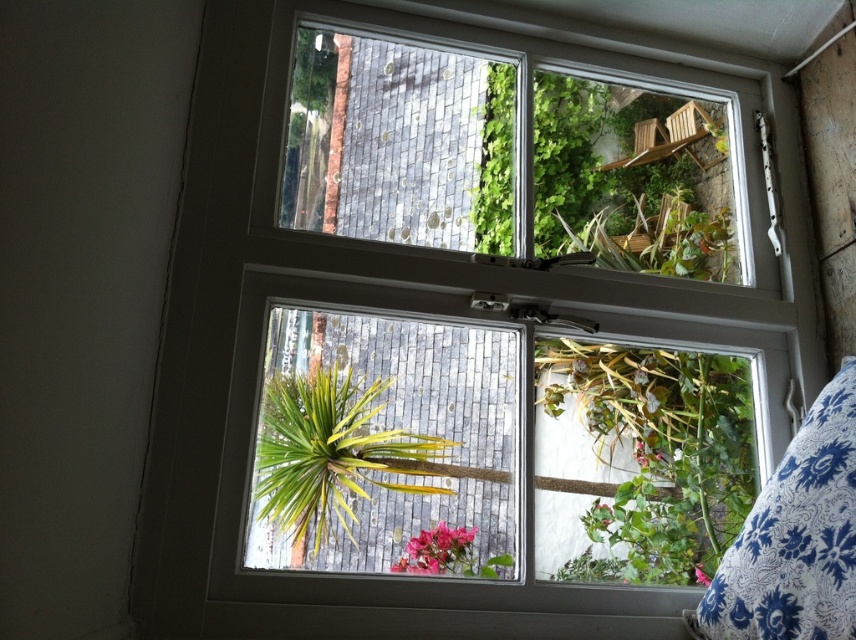
You are a gardener looking at the window with two green leafy plants visible. Which of the two plants, the green leafy plant at lower right or the green leafy plant at center, has a wider spread?

The green leafy plant at lower right has a wider spread than the green leafy plant at center.

You are a gardener who needs to water the plants outside the window. You have a watering can that can reach up to 5 feet. The green leafy plant at lower right is one of the plants you need to water. Can you reach it from where you are standing without moving your position?

The green leafy plant at lower right is 5.18 feet away, which is beyond the 5 feet reach of the watering can. Therefore, you cannot reach it without moving your position.

You are arranging a cozy reading nook by the window. You have a blue floral fabric pillow at lower right and a pink matte flower at lower center. Which object is taller?

The blue floral fabric pillow at lower right is taller than the pink matte flower at lower center according to the description.